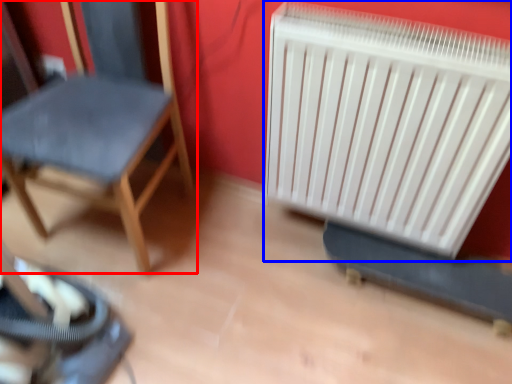
Question: Among these objects, which one is farthest to the camera, chair (highlighted by a red box) or radiator (highlighted by a blue box)?

Choices:
 (A) chair
 (B) radiator

Answer: (B)